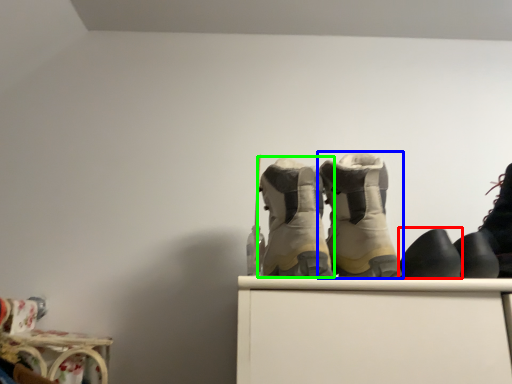
Question: Considering the real-world distances, which object is farthest from footwear (highlighted by a red box)? footwear (highlighted by a blue box) or footwear (highlighted by a green box)?

Choices:
 (A) footwear
 (B) footwear

Answer: (B)